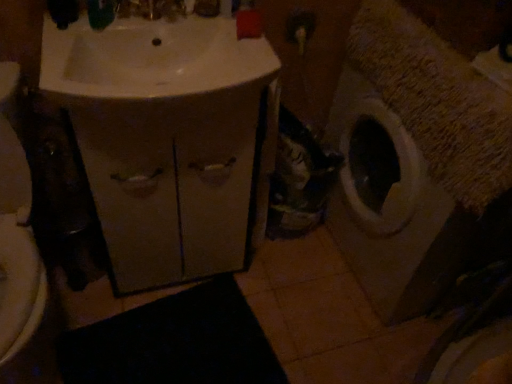
The width and height of the screenshot is (512, 384). I want to click on unoccupied region to the right of black rubber bath mat at lower center, so click(323, 330).